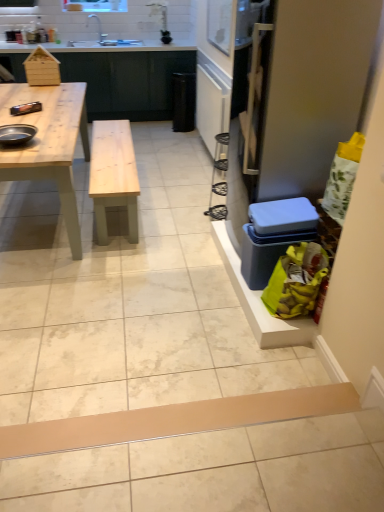
Find the location of `vacant space to the right of shiny black pan at left`. vacant space to the right of shiny black pan at left is located at coordinates (60, 139).